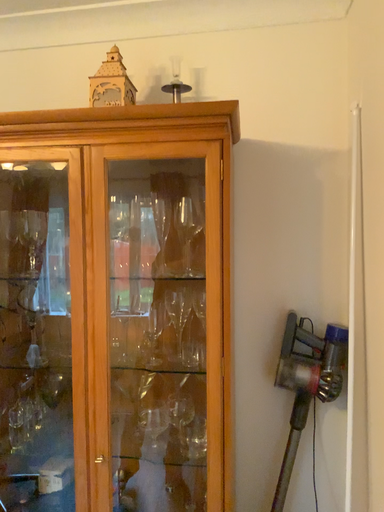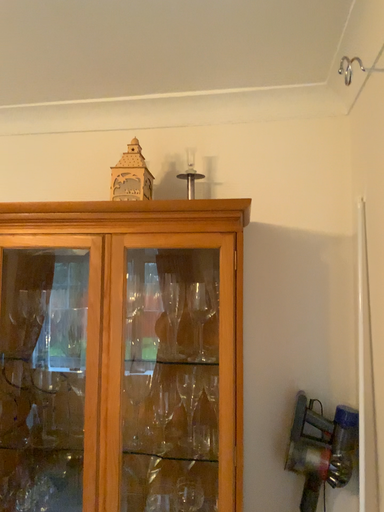
Question: Which way did the camera rotate in the video?

Choices:
 (A) rotated upward
 (B) rotated downward

Answer: (A)